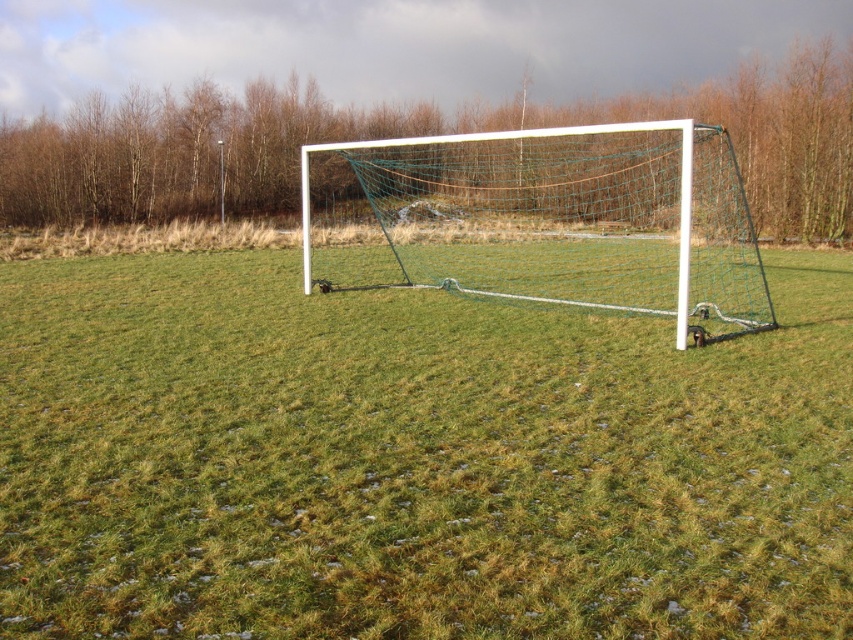
Question: Can you confirm if green grass at center is positioned above white plastic goal at center?

Choices:
 (A) no
 (B) yes

Answer: (A)

Question: Which of the following is the farthest from the observer?

Choices:
 (A) (9, 340)
 (B) (537, 163)

Answer: (B)

Question: Does green grass at center have a smaller size compared to white plastic goal at center?

Choices:
 (A) no
 (B) yes

Answer: (B)

Question: Which of the following is the closest to the observer?

Choices:
 (A) green grass at center
 (B) white plastic goal at center

Answer: (A)

Question: Which point appears farthest from the camera in this image?

Choices:
 (A) (579, 417)
 (B) (352, 252)

Answer: (B)

Question: In this image, where is green grass at center located relative to white plastic goal at center?

Choices:
 (A) right
 (B) left

Answer: (B)